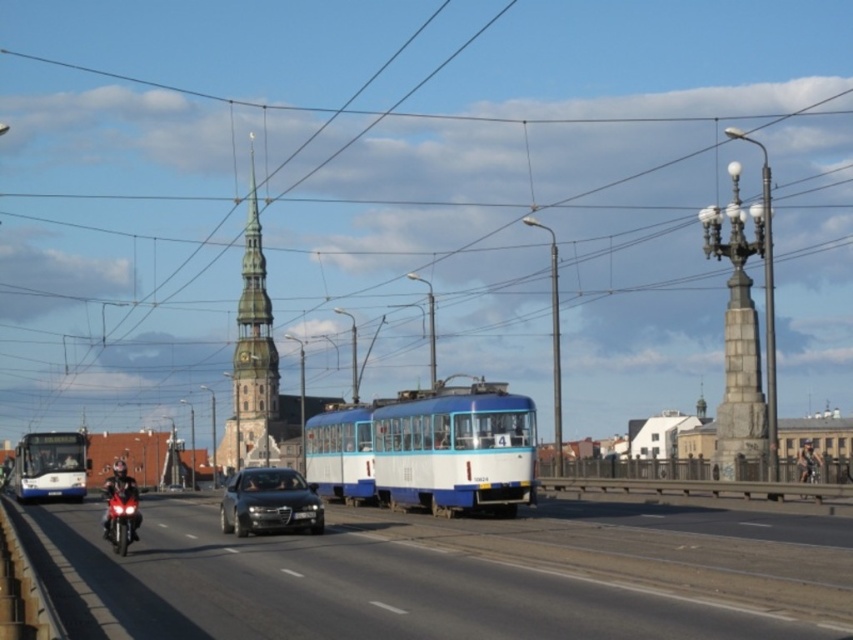
You are a delivery person who needs to cross the road safely. There is a white glossy bus at left and a black car ahead. Based on their positions, which vehicle should you wait for before crossing?

The white glossy bus at left is located at point (49, 467), which is closer to your position compared to the black car. Therefore, you should wait for the white glossy bus at left to pass first before crossing the road safely.

You are a pedestrian standing at the edge of the road. You see a black rubber motorcycle at lower left and a shiny red motorcycle at lower left. Which motorcycle is taller?

The black rubber motorcycle at lower left is much taller than the shiny red motorcycle at lower left.